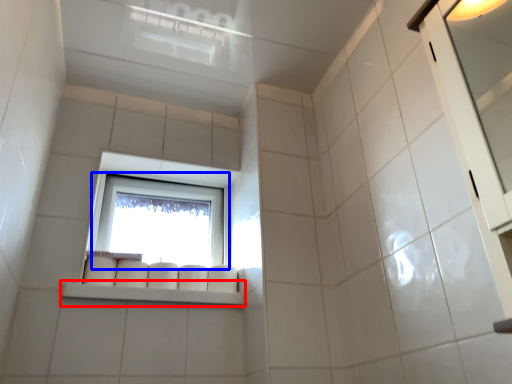
Question: Which point is closer to the camera, window sill (highlighted by a red box) or window (highlighted by a blue box)?

Choices:
 (A) window sill
 (B) window

Answer: (A)